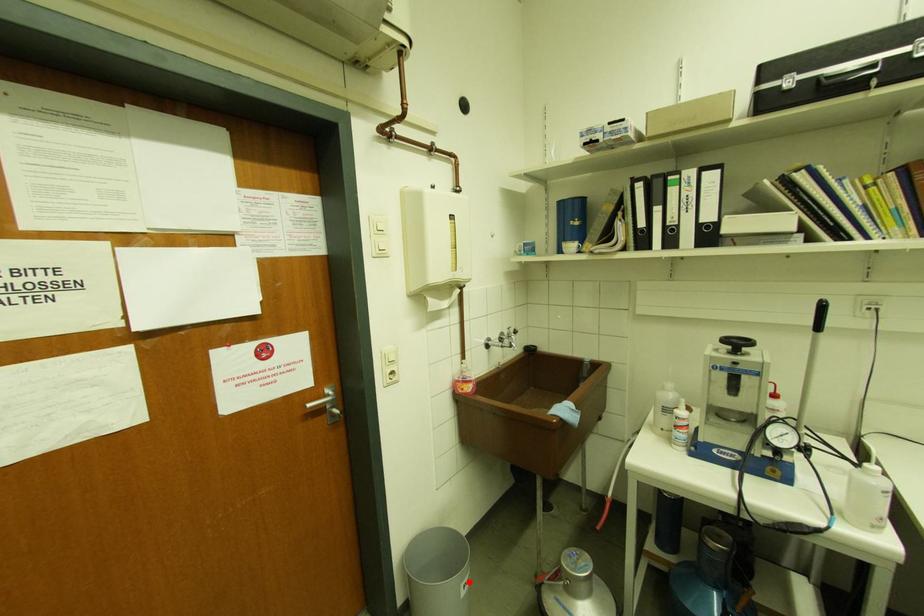
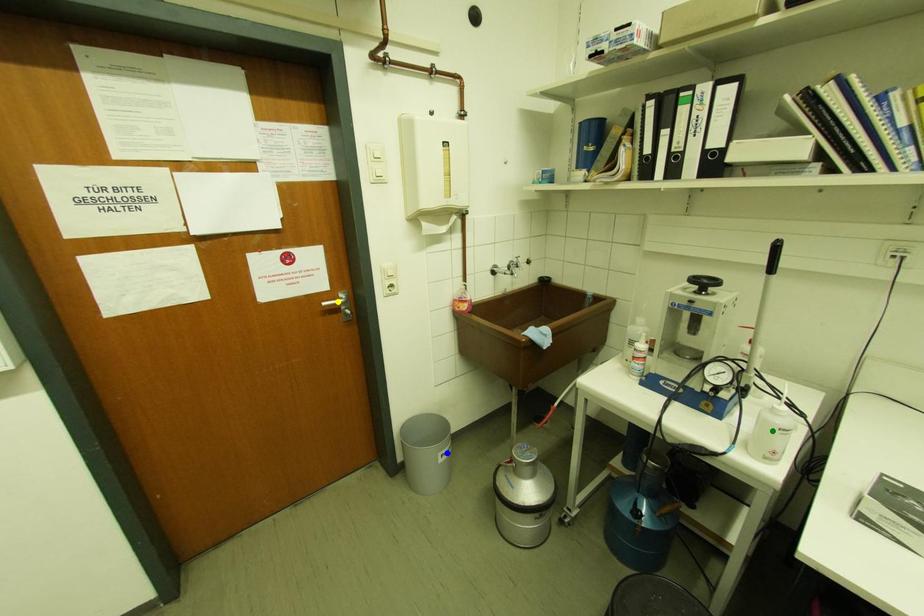
Question: I am providing you with two images of the same scene from different viewpoints. A red point is marked on the first image. You are given multiple points on the second image. Which point in image 2 represents the same 3d spot as the red point in image 1?

Choices:
 (A) blue point
 (B) green point
 (C) yellow point

Answer: (A)